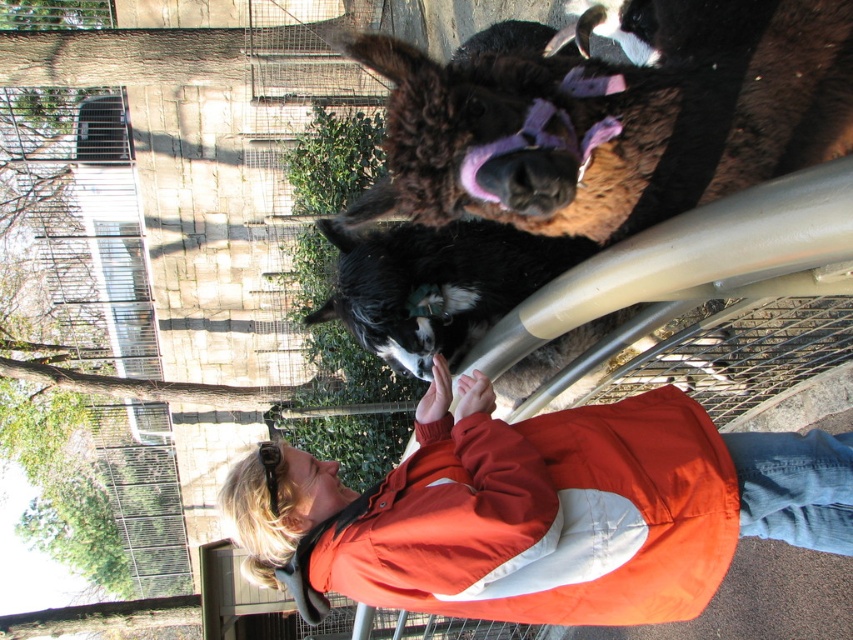
Question: Which object is positioned farthest from the black fur dog at center?

Choices:
 (A) brown fuzzy donkey at upper center
 (B) orange fabric jacket at upper center

Answer: (A)

Question: Which object is positioned farthest from the black fur dog at center?

Choices:
 (A) brown fuzzy donkey at upper center
 (B) orange fabric jacket at upper center

Answer: (A)

Question: Which point appears closest to the camera in this image?

Choices:
 (A) (439, 140)
 (B) (407, 332)
 (C) (561, 513)

Answer: (A)

Question: Is brown fuzzy donkey at upper center below black fur dog at center?

Choices:
 (A) no
 (B) yes

Answer: (A)

Question: Is the position of orange fabric jacket at upper center less distant than that of brown fuzzy donkey at upper center?

Choices:
 (A) yes
 (B) no

Answer: (B)

Question: Is orange fabric jacket at upper center behind black fur dog at center?

Choices:
 (A) yes
 (B) no

Answer: (B)